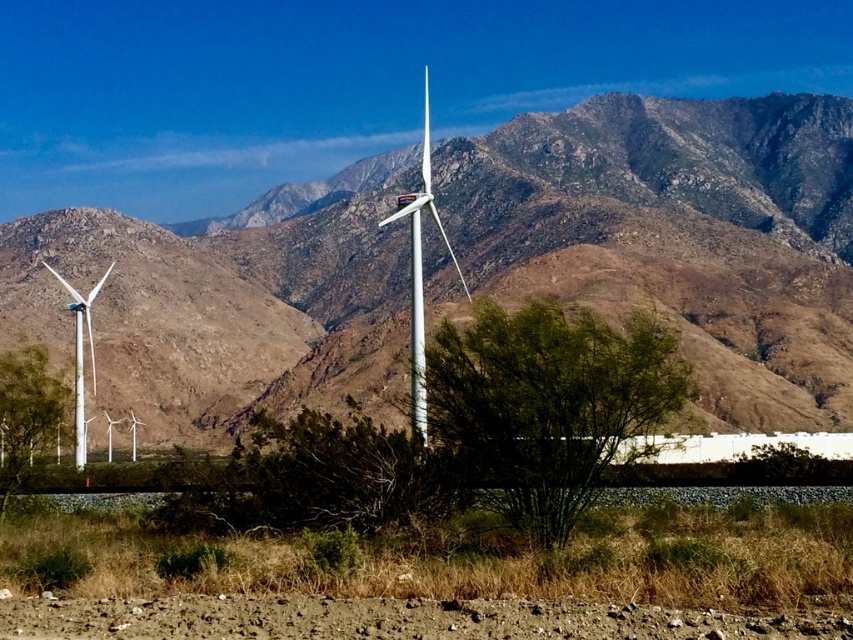
Question: Considering the relative positions of white matte wind turbine at center and white matte wind turbine at left in the image provided, where is white matte wind turbine at center located with respect to white matte wind turbine at left?

Choices:
 (A) below
 (B) above

Answer: (B)

Question: Can you confirm if brown rocky mountain range at center is thinner than white matte wind turbine at center?

Choices:
 (A) yes
 (B) no

Answer: (B)

Question: Can you confirm if white matte wind turbine at center is positioned to the right of white matte wind turbine at left?

Choices:
 (A) yes
 (B) no

Answer: (A)

Question: Which is nearer to the brown rocky mountain range at center?

Choices:
 (A) white matte wind turbine at left
 (B) white matte wind turbine at center

Answer: (B)

Question: Which object appears closest to the camera in this image?

Choices:
 (A) white matte wind turbine at left
 (B) brown rocky mountain range at center

Answer: (B)

Question: Which of the following is the farthest from the observer?

Choices:
 (A) white matte wind turbine at center
 (B) brown rocky mountain range at center
 (C) white matte wind turbine at left

Answer: (C)